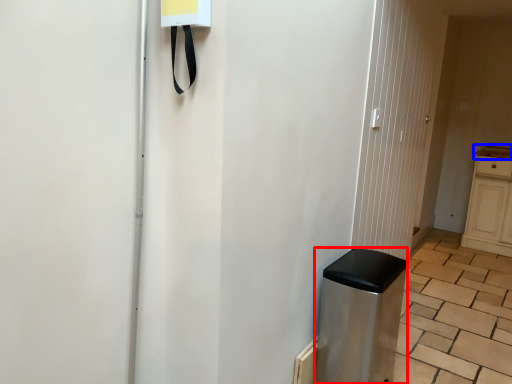
Question: Among these objects, which one is farthest to the camera, appliance (highlighted by a red box) or counter top (highlighted by a blue box)?

Choices:
 (A) appliance
 (B) counter top

Answer: (B)